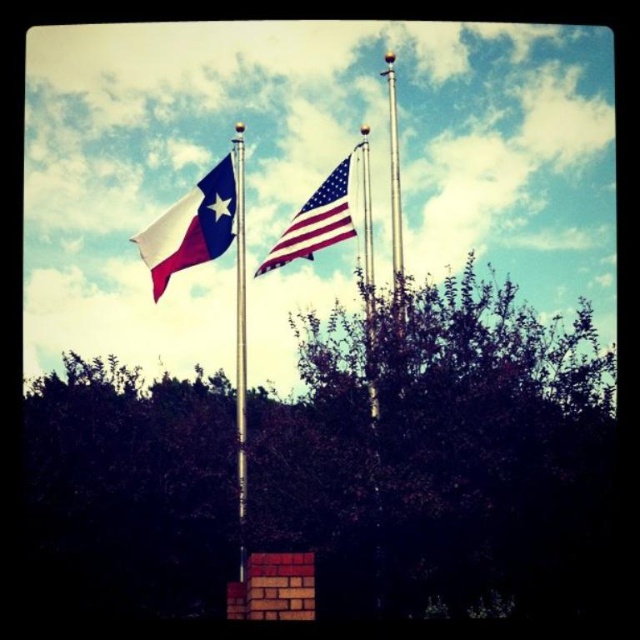
You are standing in front of the flagpoles and want to take a photo of the polished metal flag pole at center without the matte blue flag at left blocking it. Is this possible given their positions?

The polished metal flag pole at center is behind the matte blue flag at left, so taking a photo of the polished metal flag pole at center without the matte blue flag at left blocking it would not be possible as the flag is in front.

You are standing between the matte blue flag at left and the american flag at center. If you want to reach the nearest flag, which one should you grab?

The matte blue flag at left is 1.65 meters away from the american flag at center. Since you are standing between them, the nearest flag would depend on your exact position. However, without specific positioning details, it is impossible to determine which flag is closer.

You are standing in front of the two flagpoles and notice a green leafy tree at center and an american flag at center. Which object is closer to you?

The green leafy tree at center is closer to you because it is in front of the american flag at center.